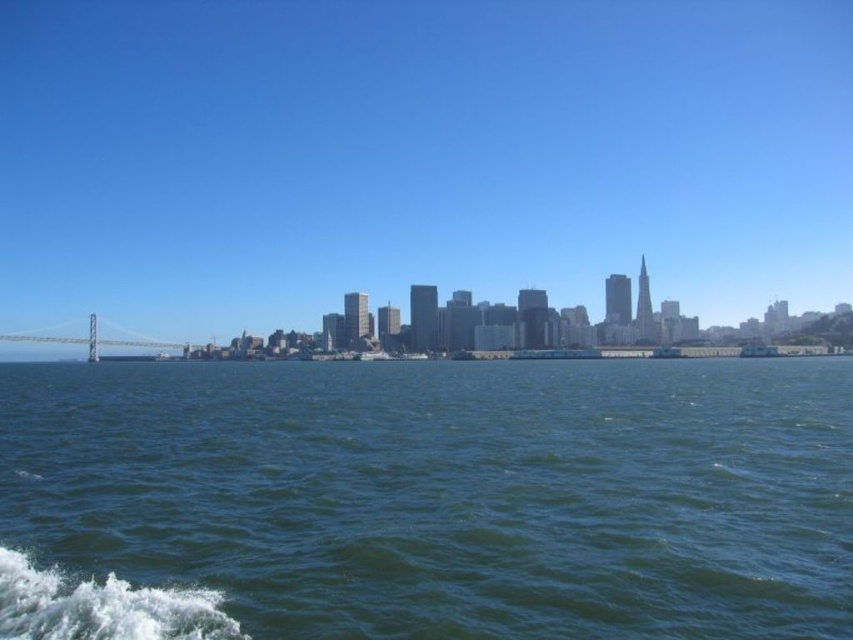
Can you confirm if blue sky at upper center is positioned above metallic gray bridge at left?

Yes, blue sky at upper center is above metallic gray bridge at left.

Is blue sky at upper center bigger than metallic gray bridge at left?

Yes, blue sky at upper center is bigger than metallic gray bridge at left.

Where is `blue sky at upper center`? The image size is (853, 640). blue sky at upper center is located at coordinates (416, 157).

Can you confirm if blue sky at upper center is shorter than green water at center?

In fact, blue sky at upper center may be taller than green water at center.

Is point (334, 300) positioned in front of point (427, 509)?

No, (334, 300) is further to viewer.

Between point (564, 90) and point (561, 609), which one is positioned in front?

Point (561, 609) is more forward.

Where is `blue sky at upper center`? The height and width of the screenshot is (640, 853). blue sky at upper center is located at coordinates (416, 157).

Does green water at center have a greater height compared to metallic gray bridge at left?

No, green water at center is not taller than metallic gray bridge at left.

Who is more forward, (53,608) or (165,346)?

Positioned in front is point (53,608).

Is point (316, 417) in front of point (109, 342)?

Yes, it is.

Find the location of a particular element. Image resolution: width=853 pixels, height=640 pixels. green water at center is located at coordinates (427, 500).